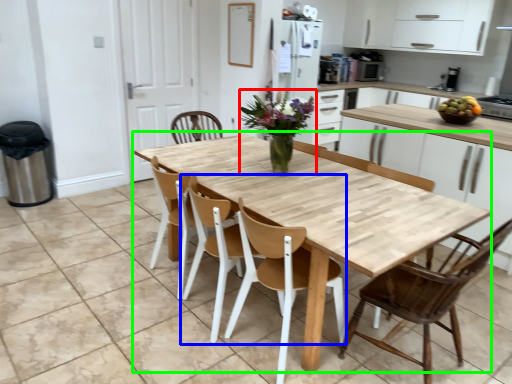
Question: Which object is the farthest from floral arrangement (highlighted by a red box)? Choose among these: chair (highlighted by a blue box) or kitchen & dining room table (highlighted by a green box).

Choices:
 (A) chair
 (B) kitchen & dining room table

Answer: (A)